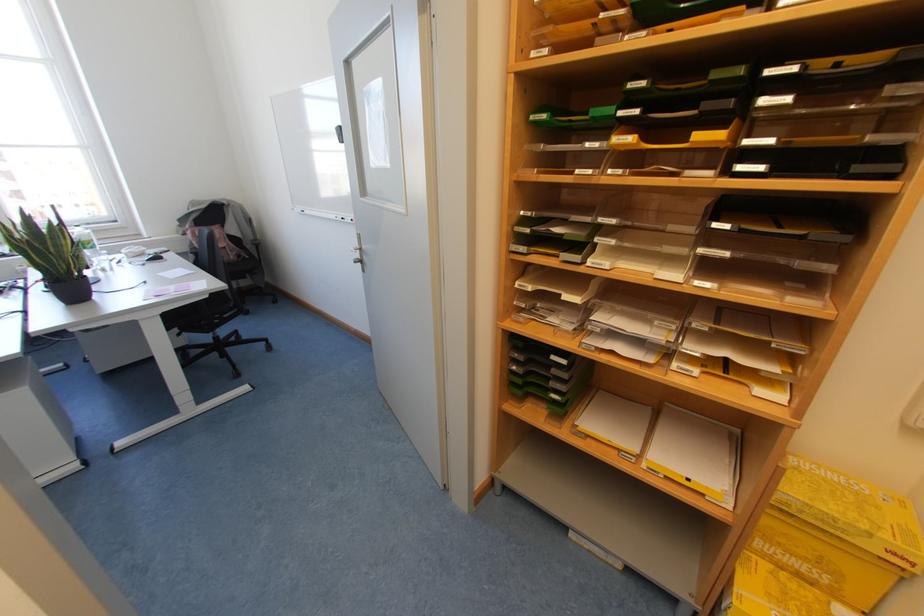
Find the location of a particular element. The width and height of the screenshot is (924, 616). black chair sitting surface is located at coordinates (200, 312).